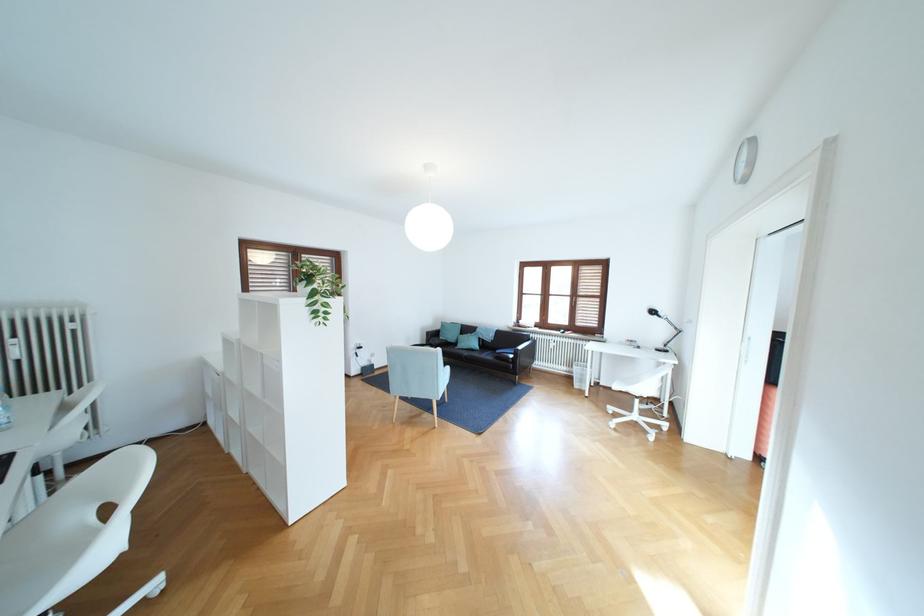
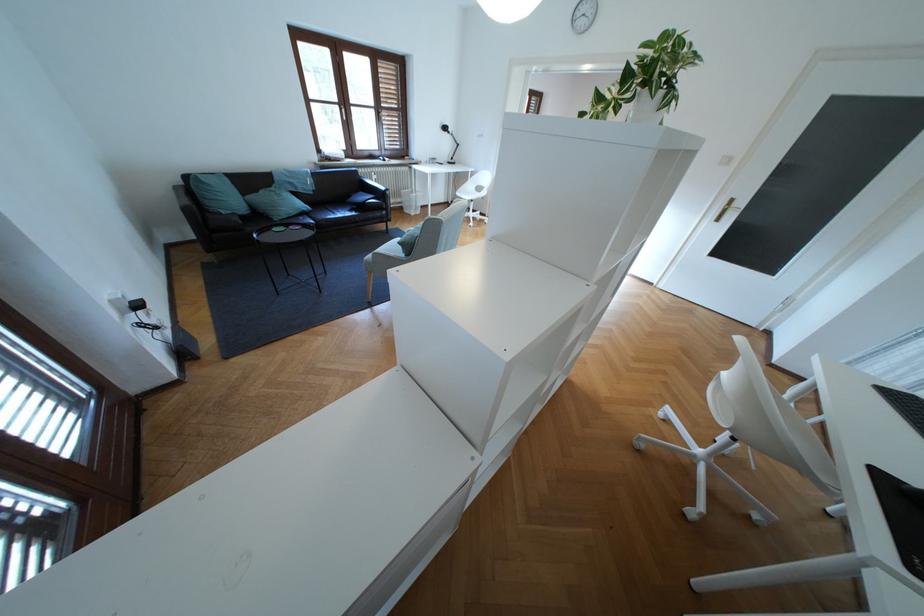
Locate, in the second image, the point that corresponds to point 470,334 in the first image.

(253, 193)